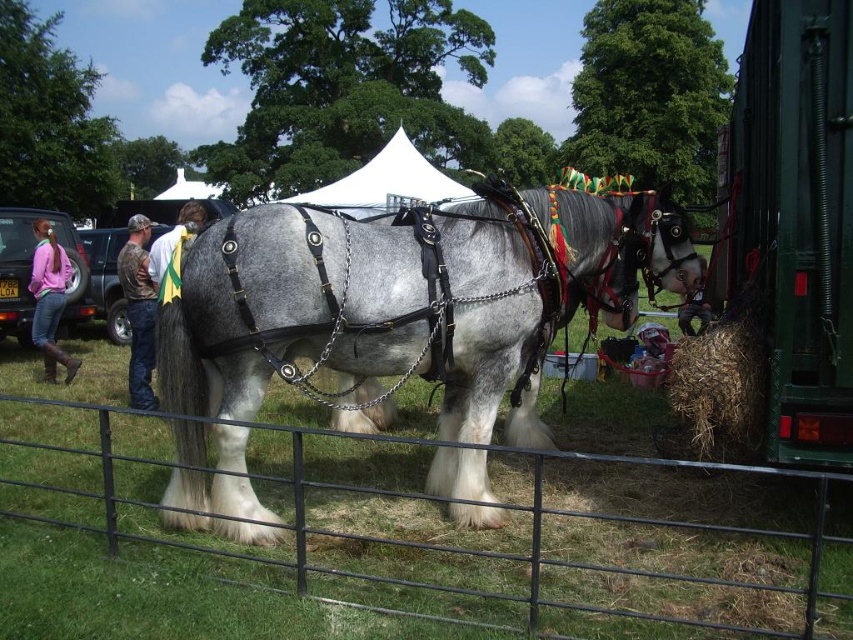
You are standing at point (701, 284) and want to walk to point (140, 225). Is the path between these two points clear of any obstacles?

Point (140, 225) is behind point (701, 284), so the path between them may be blocked by the horse or other objects in front of point (701, 284). You should check for any obstacles before proceeding.

You are a photographer trying to capture a photo of the gray shaggy horse at center and the brown leather boots at lower right in the same frame. Based on their positions, will the horse appear larger in the photo compared to the boots?

The gray shaggy horse at center is much taller than the brown leather boots at lower right, so yes, the horse will appear larger in the photo compared to the boots.